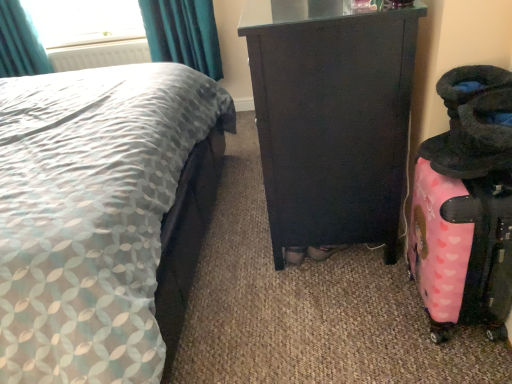
Question: Is pink matte suitcase at right with matte black cabinet at center?

Choices:
 (A) no
 (B) yes

Answer: (A)

Question: Considering the relative sizes of pink matte suitcase at right and matte black cabinet at center in the image provided, is pink matte suitcase at right bigger than matte black cabinet at center?

Choices:
 (A) no
 (B) yes

Answer: (A)

Question: Does pink matte suitcase at right turn towards matte black cabinet at center?

Choices:
 (A) no
 (B) yes

Answer: (A)

Question: From a real-world perspective, does pink matte suitcase at right stand above matte black cabinet at center?

Choices:
 (A) no
 (B) yes

Answer: (A)

Question: Is pink matte suitcase at right at the left side of matte black cabinet at center?

Choices:
 (A) yes
 (B) no

Answer: (B)

Question: Can you confirm if pink matte suitcase at right is shorter than matte black cabinet at center?

Choices:
 (A) yes
 (B) no

Answer: (A)

Question: From a real-world perspective, is pink matte suitcase at right positioned over white plastic radiator at upper left based on gravity?

Choices:
 (A) no
 (B) yes

Answer: (A)

Question: Considering the relative sizes of pink matte suitcase at right and white plastic radiator at upper left in the image provided, is pink matte suitcase at right shorter than white plastic radiator at upper left?

Choices:
 (A) yes
 (B) no

Answer: (B)

Question: Is pink matte suitcase at right positioned far away from white plastic radiator at upper left?

Choices:
 (A) yes
 (B) no

Answer: (A)

Question: Is pink matte suitcase at right thinner than white plastic radiator at upper left?

Choices:
 (A) no
 (B) yes

Answer: (A)

Question: Is pink matte suitcase at right oriented towards white plastic radiator at upper left?

Choices:
 (A) no
 (B) yes

Answer: (A)

Question: Considering the relative sizes of pink matte suitcase at right and white plastic radiator at upper left in the image provided, is pink matte suitcase at right taller than white plastic radiator at upper left?

Choices:
 (A) no
 (B) yes

Answer: (B)

Question: Considering the relative sizes of teal fabric curtain at upper left and matte gray fabric bed at left in the image provided, is teal fabric curtain at upper left bigger than matte gray fabric bed at left?

Choices:
 (A) no
 (B) yes

Answer: (A)